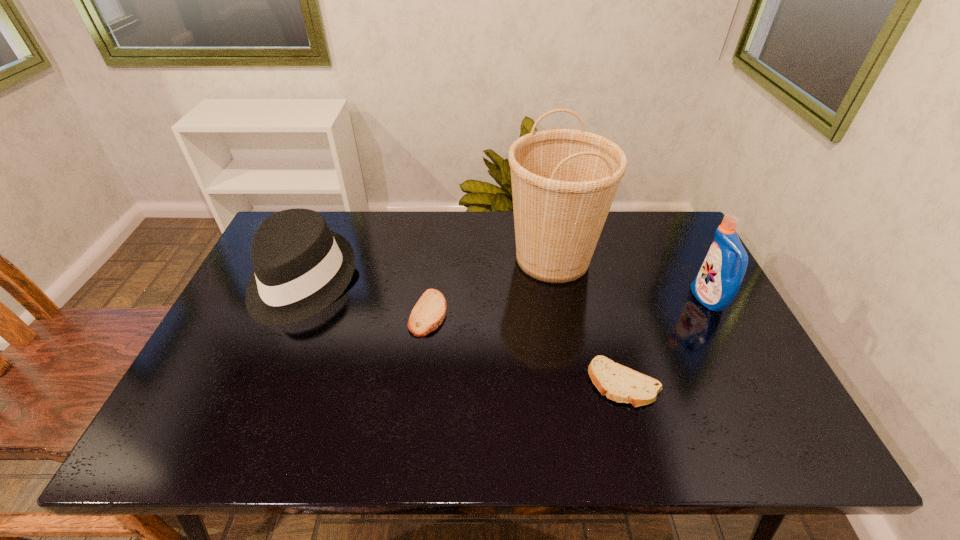
Where is `basket`? Image resolution: width=960 pixels, height=540 pixels. basket is located at coordinates (564, 181).

Identify the location of detergent. (717, 283).

Find the location of a particular element. the rightmost object is located at coordinates (717, 283).

Where is `the third tallest object`? the third tallest object is located at coordinates (301, 267).

What are the coordinates of `fedora` in the screenshot? It's located at (301, 267).

Image resolution: width=960 pixels, height=540 pixels. I want to click on the fourth object from right to left, so click(x=429, y=312).

Image resolution: width=960 pixels, height=540 pixels. Find the location of `the farther pita bread`. the farther pita bread is located at coordinates (429, 312).

You are a GUI agent. You are given a task and a screenshot of the screen. Output one action in this format:
    pyautogui.click(x=<x>, y=<y>)
    Task: Click on the shorter pita bread
    
    Given the screenshot: What is the action you would take?
    619,383

At what (x,y) coordinates should I click in order to perform the action: click on the nearest object. Please return your answer as a coordinate pair (x, y). Looking at the image, I should click on (619, 383).

The image size is (960, 540). I want to click on free region located 0.100m on the left of the tallest object, so click(472, 258).